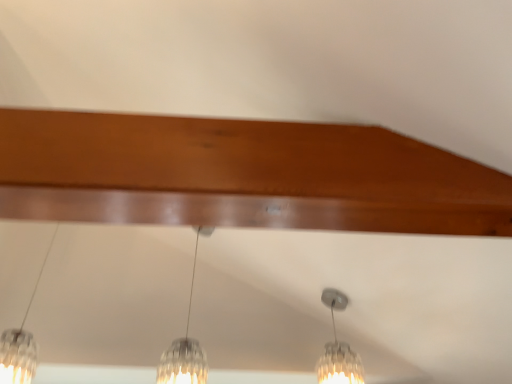
Question: Which direction should I rotate to look at clear glass pendant light at center, positioned as the second lamp in right-to-left order, — up or down?

Choices:
 (A) up
 (B) down

Answer: (B)

Question: From the image's perspective, is clear glass pendant light at left, the first lamp when ordered from left to right, over clear glass pendant light at center, which appears as the second lamp when viewed from the left?

Choices:
 (A) yes
 (B) no

Answer: (A)

Question: From the image's perspective, does clear glass pendant light at left, placed as the 3th lamp when sorted from right to left, appear lower than clear glass pendant light at center, which appears as the second lamp when viewed from the left?

Choices:
 (A) no
 (B) yes

Answer: (A)

Question: Is clear glass pendant light at left, the first lamp when ordered from left to right, smaller than clear glass pendant light at center, which appears as the second lamp when viewed from the left?

Choices:
 (A) no
 (B) yes

Answer: (A)

Question: Is the surface of clear glass pendant light at left, the first lamp when ordered from left to right, in direct contact with clear glass pendant light at center, positioned as the second lamp in right-to-left order?

Choices:
 (A) yes
 (B) no

Answer: (B)

Question: Is clear glass pendant light at left, placed as the 3th lamp when sorted from right to left, positioned with its back to clear glass pendant light at center, positioned as the second lamp in right-to-left order?

Choices:
 (A) no
 (B) yes

Answer: (B)

Question: Can you confirm if clear glass pendant light at left, placed as the 3th lamp when sorted from right to left, is thinner than clear glass pendant light at center, which appears as the second lamp when viewed from the left?

Choices:
 (A) yes
 (B) no

Answer: (B)

Question: Is clear glass pendant light at center, which appears as the second lamp when viewed from the left, smaller than clear glass pendant light at left, placed as the 3th lamp when sorted from right to left?

Choices:
 (A) no
 (B) yes

Answer: (B)

Question: Does clear glass pendant light at center, which appears as the second lamp when viewed from the left, have a larger size compared to clear glass pendant light at left, the first lamp when ordered from left to right?

Choices:
 (A) no
 (B) yes

Answer: (A)

Question: From the image's perspective, is clear glass pendant light at center, which appears as the second lamp when viewed from the left, beneath clear glass pendant light at left, placed as the 3th lamp when sorted from right to left?

Choices:
 (A) yes
 (B) no

Answer: (A)

Question: Can you confirm if clear glass pendant light at center, which appears as the second lamp when viewed from the left, is taller than clear glass pendant light at left, the first lamp when ordered from left to right?

Choices:
 (A) yes
 (B) no

Answer: (A)

Question: From a real-world perspective, does clear glass pendant light at center, positioned as the second lamp in right-to-left order, sit lower than clear glass pendant light at left, the first lamp when ordered from left to right?

Choices:
 (A) yes
 (B) no

Answer: (B)

Question: Could you tell me if clear glass pendant light at center, which appears as the second lamp when viewed from the left, is turned towards clear glass pendant light at left, the first lamp when ordered from left to right?

Choices:
 (A) yes
 (B) no

Answer: (A)

Question: Does clear glass pendant light at left, the first lamp when ordered from left to right, appear on the left side of clear glass pendant light at center, positioned as the first lamp in right-to-left order?

Choices:
 (A) no
 (B) yes

Answer: (B)